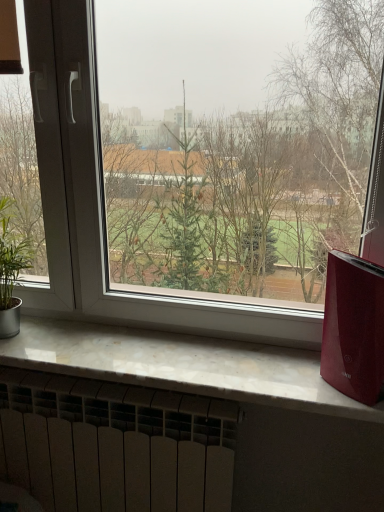
Question: From the image's perspective, does green leafy plant at left appear higher than shiny red air purifier at right?

Choices:
 (A) no
 (B) yes

Answer: (B)

Question: Can you confirm if green leafy plant at left is shorter than shiny red air purifier at right?

Choices:
 (A) no
 (B) yes

Answer: (A)

Question: From the image's perspective, is green leafy plant at left under shiny red air purifier at right?

Choices:
 (A) no
 (B) yes

Answer: (A)

Question: Is green leafy plant at left positioned beyond the bounds of shiny red air purifier at right?

Choices:
 (A) yes
 (B) no

Answer: (A)

Question: Can you confirm if green leafy plant at left is positioned to the right of shiny red air purifier at right?

Choices:
 (A) yes
 (B) no

Answer: (B)

Question: From the image's perspective, is green leafy plant at left positioned above or below shiny red air purifier at right?

Choices:
 (A) above
 (B) below

Answer: (A)

Question: Is green leafy plant at left taller or shorter than shiny red air purifier at right?

Choices:
 (A) short
 (B) tall

Answer: (B)

Question: Considering the positions of green leafy plant at left and shiny red air purifier at right in the image, is green leafy plant at left wider or thinner than shiny red air purifier at right?

Choices:
 (A) thin
 (B) wide

Answer: (B)

Question: In the image, is green leafy plant at left on the left side or the right side of shiny red air purifier at right?

Choices:
 (A) right
 (B) left

Answer: (B)

Question: In terms of width, does shiny red air purifier at right look wider or thinner when compared to transparent glass window at center?

Choices:
 (A) wide
 (B) thin

Answer: (A)

Question: Choose the correct answer: Is shiny red air purifier at right inside transparent glass window at center or outside it?

Choices:
 (A) outside
 (B) inside

Answer: (A)

Question: In the image, is shiny red air purifier at right positioned in front of or behind transparent glass window at center?

Choices:
 (A) behind
 (B) front

Answer: (A)

Question: From a real-world perspective, is shiny red air purifier at right physically located above or below transparent glass window at center?

Choices:
 (A) below
 (B) above

Answer: (A)

Question: Is point (142, 313) positioned closer to the camera than point (3, 281)?

Choices:
 (A) closer
 (B) farther

Answer: (B)

Question: Visually, is transparent glass window at center positioned to the left or to the right of green leafy plant at left?

Choices:
 (A) right
 (B) left

Answer: (A)